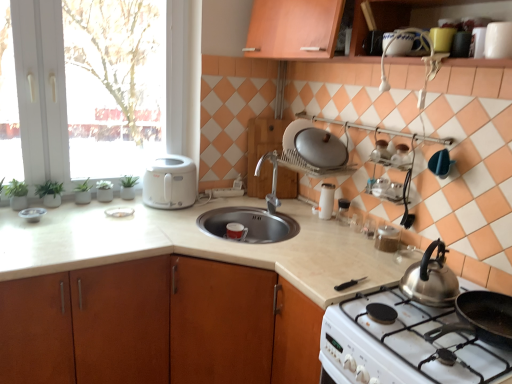
Where is `free location in front of metallic silver bowl at left, the fifth appliance viewed from the top`? free location in front of metallic silver bowl at left, the fifth appliance viewed from the top is located at coordinates pyautogui.click(x=23, y=226).